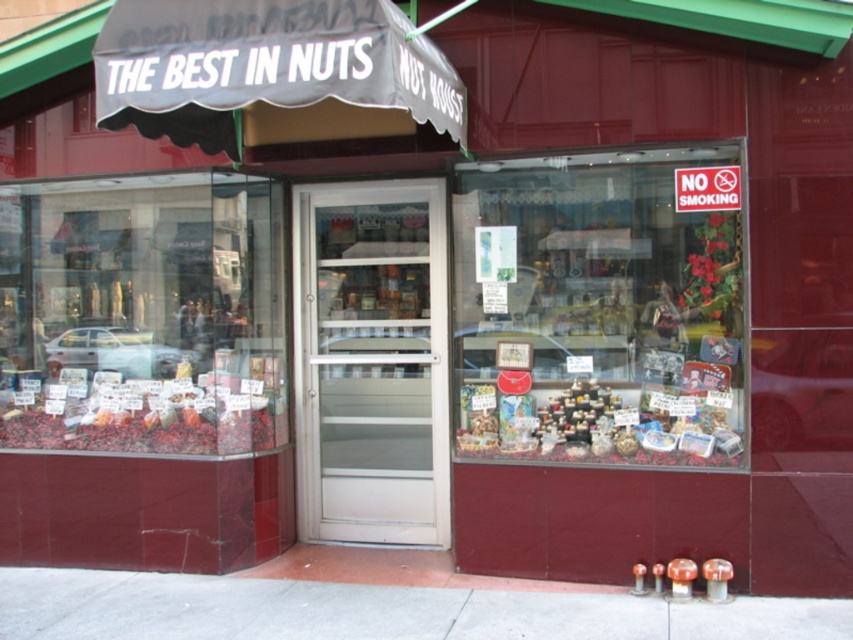
You are a customer standing outside the store and want to enter. The translucent glass display case at center and the white frosted glass door at center are both in front of you. Which object would you need to move through to get inside the store?

To enter the store, you would need to move through the white frosted glass door at center, as the translucent glass display case at center is in front of it and blocking the entrance.

You are a delivery person who needs to enter the shop. The white frosted glass door at center is the entrance. However, you have a large package that requires you to duck down to pass through the door. Considering the height of the gray concrete sidewalk at lower center, do you think the door is tall enough for you to enter without bending?

The white frosted glass door at center is much taller than the gray concrete sidewalk at lower center. Since the door is significantly taller, it should provide enough clearance for you to enter without needing to duck, assuming the sidewalk height is a reference point for the door height.